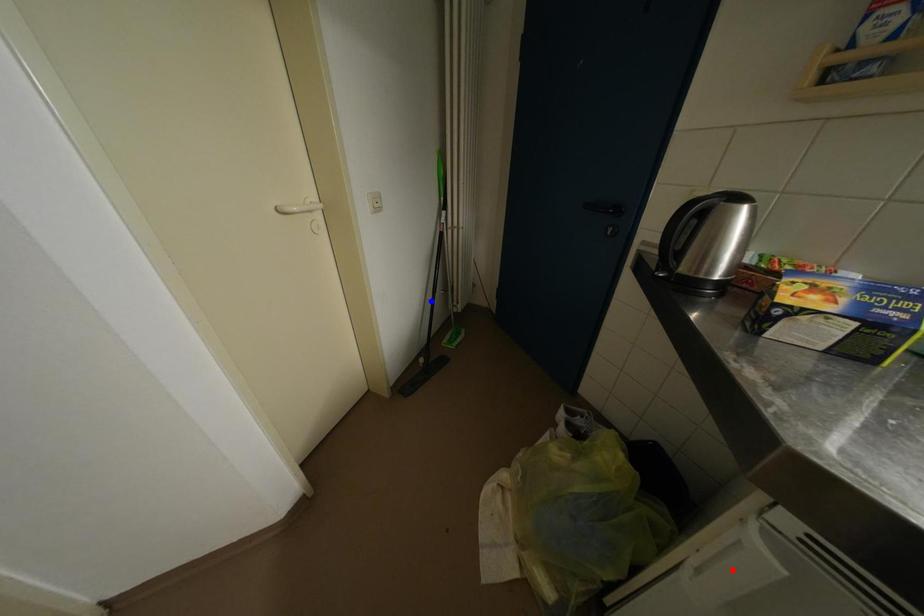
Question: Which of the two points in the image is closer to the camera?

Choices:
 (A) Blue point is closer.
 (B) Red point is closer.

Answer: (B)